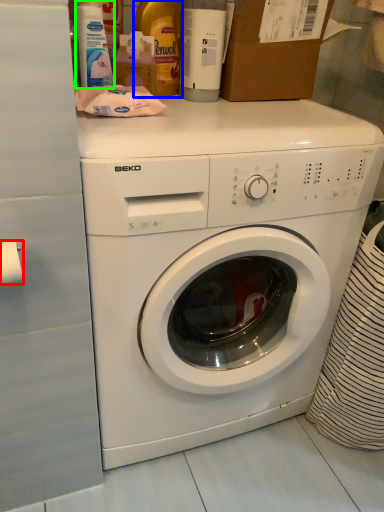
Question: Which is farther away from toilet paper (highlighted by a red box)? bottle (highlighted by a blue box) or cleaning product (highlighted by a green box)?

Choices:
 (A) bottle
 (B) cleaning product

Answer: (A)